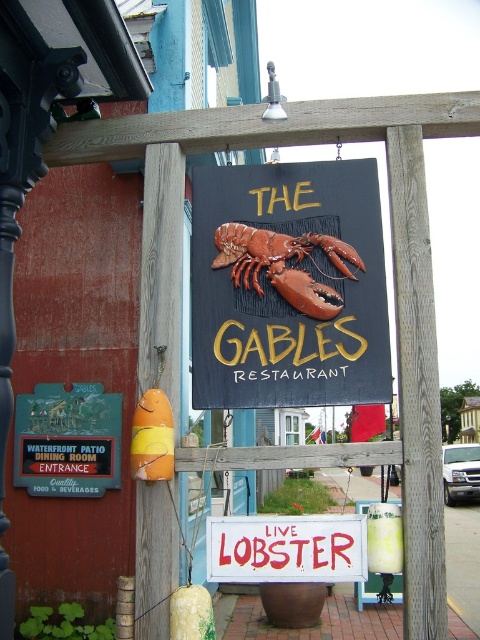
You are a painter hired to paint both the matte wooden signboard with lobster at center and the red painted wood sign at center. Which sign requires more paint due to its size?

The matte wooden signboard with lobster at center requires more paint because it has a larger size compared to the red painted wood sign at center.

You are a painter hired to touch up the signs at The Gables Restaurant. You need to reach both the matte wooden signboard with lobster at center and the red painted wood sign at center. Which sign should you tackle first if you want to start with the one that is higher up?

The matte wooden signboard with lobster at center is located above the red painted wood sign at center, so you should start with the matte wooden signboard with lobster at center first since it is higher up.